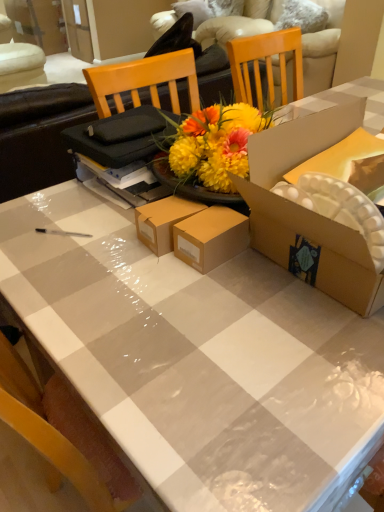
Locate an element on the screen. This screenshot has width=384, height=512. cardboard box at center is located at coordinates (309, 210).

What do you see at coordinates (309, 210) in the screenshot? I see `cardboard box at center` at bounding box center [309, 210].

Describe the element at coordinates (322, 49) in the screenshot. The image size is (384, 512). I see `beige fabric couch at upper center` at that location.

You are a GUI agent. You are given a task and a screenshot of the screen. Output one action in this format:
    pyautogui.click(x=<x>, y=<y>)
    Task: Click on the beige fabric couch at upper center
    
    Given the screenshot: What is the action you would take?
    pyautogui.click(x=322, y=49)

Find the location of `cardboard box at center`. cardboard box at center is located at coordinates (309, 210).

In the scene shown: Which object is positioned more to the left, beige fabric couch at upper center or cardboard box at center?

cardboard box at center.

Does beige fabric couch at upper center come in front of cardboard box at center?

No, it is behind cardboard box at center.

Considering the points (328, 32) and (259, 236), which point is behind, point (328, 32) or point (259, 236)?

Positioned behind is point (328, 32).

From the image's perspective, is beige fabric couch at upper center over cardboard box at center?

Yes, from the image's perspective, beige fabric couch at upper center is over cardboard box at center.

From a real-world perspective, which object stands above the other?

From a 3D spatial view, cardboard box at center is above.

Does beige fabric couch at upper center have a lesser width compared to cardboard box at center?

In fact, beige fabric couch at upper center might be wider than cardboard box at center.

Does beige fabric couch at upper center have a lesser height compared to cardboard box at center?

Incorrect, the height of beige fabric couch at upper center does not fall short of that of cardboard box at center.

Between beige fabric couch at upper center and cardboard box at center, which one has larger size?

beige fabric couch at upper center.

Which is correct: beige fabric couch at upper center is inside cardboard box at center, or outside of it?

beige fabric couch at upper center exists outside the volume of cardboard box at center.

Is beige fabric couch at upper center directly adjacent to cardboard box at center?

No, beige fabric couch at upper center is not in contact with cardboard box at center.

Is beige fabric couch at upper center looking in the opposite direction of cardboard box at center?

beige fabric couch at upper center is not turned away from cardboard box at center.

How much distance is there between beige fabric couch at upper center and cardboard box at center?

beige fabric couch at upper center is 2.87 meters from cardboard box at center.

Locate an element on the screen. Image resolution: width=384 pixels, height=512 pixels. couch directly beneath the cardboard box at center (from a real-world perspective) is located at coordinates (322, 49).

Which object is positioned more to the left, cardboard box at center or beige fabric couch at upper center?

Positioned to the left is cardboard box at center.

Which is in front, cardboard box at center or beige fabric couch at upper center?

cardboard box at center.

Does point (370, 274) come behind point (276, 78)?

No, it is not.

From the image's perspective, between cardboard box at center and beige fabric couch at upper center, who is located below?

cardboard box at center.

From a real-world perspective, does cardboard box at center sit lower than beige fabric couch at upper center?

No, from a real-world perspective, cardboard box at center is not below beige fabric couch at upper center.

Can you confirm if cardboard box at center is thinner than beige fabric couch at upper center?

Indeed, cardboard box at center has a lesser width compared to beige fabric couch at upper center.

Considering the relative sizes of cardboard box at center and beige fabric couch at upper center in the image provided, is cardboard box at center shorter than beige fabric couch at upper center?

Indeed, cardboard box at center has a lesser height compared to beige fabric couch at upper center.

Is cardboard box at center bigger or smaller than beige fabric couch at upper center?

Clearly, cardboard box at center is smaller in size than beige fabric couch at upper center.

Is cardboard box at center completely or partially outside of beige fabric couch at upper center?

Absolutely, cardboard box at center is external to beige fabric couch at upper center.

Are cardboard box at center and beige fabric couch at upper center located far from each other?

Indeed, cardboard box at center is not near beige fabric couch at upper center.

Is beige fabric couch at upper center at the back of cardboard box at center?

cardboard box at center does not have its back to beige fabric couch at upper center.

Image resolution: width=384 pixels, height=512 pixels. Find the location of `box on the left of beige fabric couch at upper center`. box on the left of beige fabric couch at upper center is located at coordinates (309, 210).

At what (x,y) coordinates should I click in order to perform the action: click on couch on the right of cardboard box at center. Please return your answer as a coordinate pair (x, y). This screenshot has height=512, width=384. Looking at the image, I should click on (322, 49).

You are a GUI agent. You are given a task and a screenshot of the screen. Output one action in this format:
    pyautogui.click(x=<x>, y=<y>)
    Task: Click on the box below the beige fabric couch at upper center (from the image's perspective)
    This screenshot has width=384, height=512.
    Given the screenshot: What is the action you would take?
    pyautogui.click(x=309, y=210)